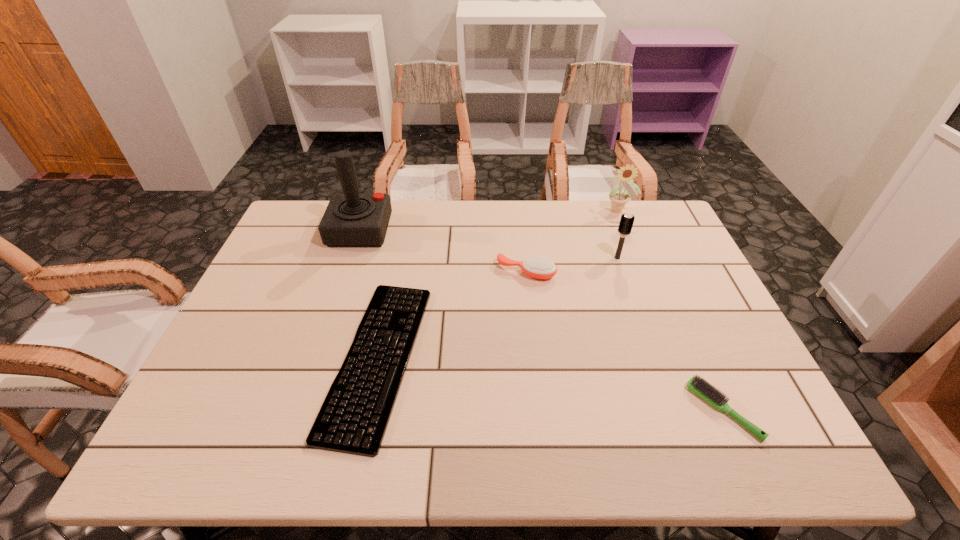
Find the location of a particular element. This screenshot has width=960, height=540. joystick is located at coordinates (351, 219).

Identify the location of sunflower. Image resolution: width=960 pixels, height=540 pixels. (618, 199).

This screenshot has width=960, height=540. In order to click on the tallest hairbrush in this screenshot , I will do `click(626, 222)`.

Identify the location of the fourth shortest object. The height and width of the screenshot is (540, 960). coord(626,222).

The image size is (960, 540). In order to click on the leftmost hairbrush in this screenshot , I will do pos(535,267).

I want to click on the fourth object from right to left, so click(x=535, y=267).

Where is `the rightmost hairbrush`? The width and height of the screenshot is (960, 540). the rightmost hairbrush is located at coordinates (704, 389).

Where is `the nearest hairbrush`? The width and height of the screenshot is (960, 540). the nearest hairbrush is located at coordinates (704, 389).

Find the location of a particular element. the shortest object is located at coordinates (353, 419).

Locate an element on the screen. The width and height of the screenshot is (960, 540). vacant region located 0.270m on the base of the tallest object is located at coordinates (471, 231).